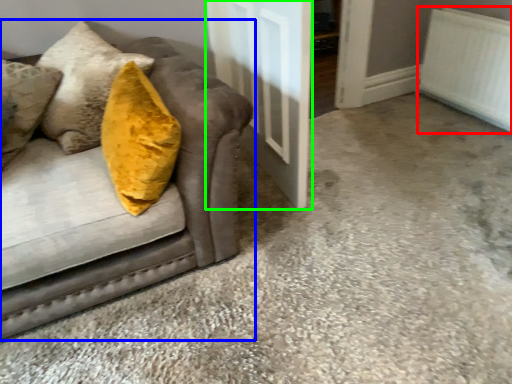
Question: Which object is the closest to the radiator (highlighted by a red box)? Choose among these: studio couch (highlighted by a blue box) or door (highlighted by a green box).

Choices:
 (A) studio couch
 (B) door

Answer: (B)